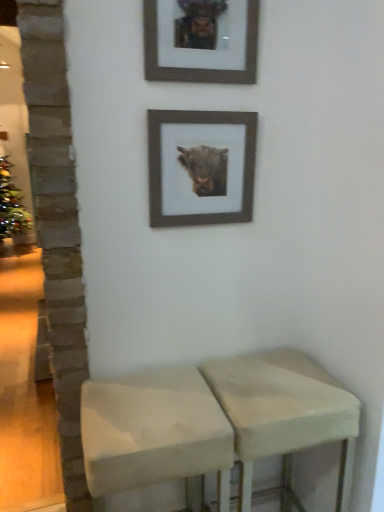
Describe the element at coordinates (284, 415) in the screenshot. I see `beige fabric stool at lower center, the second stool from the left` at that location.

In order to face beige fabric stool at lower center, which appears as the first stool when viewed from the right, should I rotate leftwards or rightwards?

It's best to rotate right around 11.016 degrees.

This screenshot has height=512, width=384. What do you see at coordinates (201, 41) in the screenshot? I see `wooden picture frame at upper center, positioned as the second picture frame in bottom-to-top order` at bounding box center [201, 41].

At what (x,y) coordinates should I click in order to perform the action: click on wooden frame at upper center, positioned as the second picture frame in top-to-bottom order. Please return your answer as a coordinate pair (x, y). Looking at the image, I should click on (201, 167).

Is beige fabric stool at lower center, which appears as the first stool when viewed from the right, located outside white fabric stool at center, which ranks as the 1th stool in left-to-right order?

Yes, beige fabric stool at lower center, which appears as the first stool when viewed from the right, is outside of white fabric stool at center, which ranks as the 1th stool in left-to-right order.

From the picture: Does beige fabric stool at lower center, the second stool from the left, have a larger size compared to white fabric stool at center, which ranks as the 1th stool in left-to-right order?

Correct, beige fabric stool at lower center, the second stool from the left, is larger in size than white fabric stool at center, which ranks as the 1th stool in left-to-right order.

Is beige fabric stool at lower center, which appears as the first stool when viewed from the right, oriented towards white fabric stool at center, positioned as the second stool in right-to-left order?

No, beige fabric stool at lower center, which appears as the first stool when viewed from the right, is not turned towards white fabric stool at center, positioned as the second stool in right-to-left order.

From the image's perspective, is wooden frame at upper center, placed as the 1th picture frame when sorted from bottom to top, below beige fabric stool at lower center, the second stool from the left?

No.

Which object is further away from the camera, wooden frame at upper center, positioned as the second picture frame in top-to-bottom order, or beige fabric stool at lower center, the second stool from the left?

wooden frame at upper center, positioned as the second picture frame in top-to-bottom order, is behind.

Which object is thinner, wooden frame at upper center, positioned as the second picture frame in top-to-bottom order, or beige fabric stool at lower center, the second stool from the left?

Thinner between the two is wooden frame at upper center, positioned as the second picture frame in top-to-bottom order.

From the picture: Is white fabric stool at center, which ranks as the 1th stool in left-to-right order, located outside wooden picture frame at upper center, acting as the first picture frame starting from the top?

white fabric stool at center, which ranks as the 1th stool in left-to-right order, lies outside wooden picture frame at upper center, acting as the first picture frame starting from the top,'s area.

Looking at this image, visually, is white fabric stool at center, which ranks as the 1th stool in left-to-right order, positioned to the left or to the right of wooden picture frame at upper center, acting as the first picture frame starting from the top?

white fabric stool at center, which ranks as the 1th stool in left-to-right order, is positioned on wooden picture frame at upper center, acting as the first picture frame starting from the top,'s left side.

Based on their sizes in the image, would you say white fabric stool at center, positioned as the second stool in right-to-left order, is bigger or smaller than wooden picture frame at upper center, acting as the first picture frame starting from the top?

In the image, white fabric stool at center, positioned as the second stool in right-to-left order, appears to be larger than wooden picture frame at upper center, acting as the first picture frame starting from the top.

From the picture: Is wooden frame at upper center, placed as the 1th picture frame when sorted from bottom to top, inside or outside of white fabric stool at center, which ranks as the 1th stool in left-to-right order?

The correct answer is: outside.

From a real-world perspective, is wooden frame at upper center, positioned as the second picture frame in top-to-bottom order, located higher than white fabric stool at center, which ranks as the 1th stool in left-to-right order?

Yes, from a real-world perspective, wooden frame at upper center, positioned as the second picture frame in top-to-bottom order, is over white fabric stool at center, which ranks as the 1th stool in left-to-right order

Between wooden frame at upper center, positioned as the second picture frame in top-to-bottom order, and white fabric stool at center, positioned as the second stool in right-to-left order, which one appears on the left side from the viewer's perspective?

From the viewer's perspective, white fabric stool at center, positioned as the second stool in right-to-left order, appears more on the left side.

Who is smaller, wooden frame at upper center, placed as the 1th picture frame when sorted from bottom to top, or white fabric stool at center, positioned as the second stool in right-to-left order?

wooden frame at upper center, placed as the 1th picture frame when sorted from bottom to top.

Find the location of a particular element. the 2nd picture frame to the right when counting from the white fabric stool at center, positioned as the second stool in right-to-left order is located at coordinates (201, 167).

Considering the points (138, 459) and (211, 220), which point is behind, point (138, 459) or point (211, 220)?

The point (211, 220) is behind.

Which is correct: white fabric stool at center, which ranks as the 1th stool in left-to-right order, is inside wooden frame at upper center, placed as the 1th picture frame when sorted from bottom to top, or outside of it?

white fabric stool at center, which ranks as the 1th stool in left-to-right order, is located beyond the bounds of wooden frame at upper center, placed as the 1th picture frame when sorted from bottom to top.

Would you consider white fabric stool at center, positioned as the second stool in right-to-left order, to be distant from wooden frame at upper center, placed as the 1th picture frame when sorted from bottom to top?

No.

Which object is wider, white fabric stool at center, which ranks as the 1th stool in left-to-right order, or beige fabric stool at lower center, which appears as the first stool when viewed from the right?

Wider between the two is white fabric stool at center, which ranks as the 1th stool in left-to-right order.

Is white fabric stool at center, which ranks as the 1th stool in left-to-right order, taller or shorter than beige fabric stool at lower center, the second stool from the left?

Clearly, white fabric stool at center, which ranks as the 1th stool in left-to-right order, is shorter compared to beige fabric stool at lower center, the second stool from the left.

Is white fabric stool at center, which ranks as the 1th stool in left-to-right order, aimed at beige fabric stool at lower center, which appears as the first stool when viewed from the right?

No, white fabric stool at center, which ranks as the 1th stool in left-to-right order, does not turn towards beige fabric stool at lower center, which appears as the first stool when viewed from the right.

How much distance is there between white fabric stool at center, positioned as the second stool in right-to-left order, and beige fabric stool at lower center, the second stool from the left?

A distance of 19.53 centimeters exists between white fabric stool at center, positioned as the second stool in right-to-left order, and beige fabric stool at lower center, the second stool from the left.

Is point (238, 426) behind point (212, 26)?

No, (238, 426) is in front of (212, 26).

Which of these two, beige fabric stool at lower center, which appears as the first stool when viewed from the right, or wooden picture frame at upper center, acting as the first picture frame starting from the top, is bigger?

beige fabric stool at lower center, which appears as the first stool when viewed from the right.

I want to click on the 2nd stool located beneath the wooden picture frame at upper center, acting as the first picture frame starting from the top (from a real-world perspective), so click(284, 415).

Is beige fabric stool at lower center, the second stool from the left, taller than wooden picture frame at upper center, acting as the first picture frame starting from the top?

Indeed, beige fabric stool at lower center, the second stool from the left, has a greater height compared to wooden picture frame at upper center, acting as the first picture frame starting from the top.

Locate an element on the screen. This screenshot has height=512, width=384. stool lying below the white fabric stool at center, positioned as the second stool in right-to-left order (from the image's perspective) is located at coordinates (284, 415).

Where is `the 2nd picture frame behind the beige fabric stool at lower center, the second stool from the left`? the 2nd picture frame behind the beige fabric stool at lower center, the second stool from the left is located at coordinates (201, 167).

Based on their spatial positions, is wooden frame at upper center, positioned as the second picture frame in top-to-bottom order, or wooden picture frame at upper center, acting as the first picture frame starting from the top, closer to white fabric stool at center, positioned as the second stool in right-to-left order?

wooden frame at upper center, positioned as the second picture frame in top-to-bottom order, is positioned closer to the anchor white fabric stool at center, positioned as the second stool in right-to-left order.

Which object lies nearer to the anchor point beige fabric stool at lower center, which appears as the first stool when viewed from the right, white fabric stool at center, which ranks as the 1th stool in left-to-right order, or wooden frame at upper center, positioned as the second picture frame in top-to-bottom order?

The object closer to beige fabric stool at lower center, which appears as the first stool when viewed from the right, is white fabric stool at center, which ranks as the 1th stool in left-to-right order.

When comparing their distances from wooden frame at upper center, placed as the 1th picture frame when sorted from bottom to top, does wooden picture frame at upper center, acting as the first picture frame starting from the top, or white fabric stool at center, which ranks as the 1th stool in left-to-right order, seem further?

The object further to wooden frame at upper center, placed as the 1th picture frame when sorted from bottom to top, is white fabric stool at center, which ranks as the 1th stool in left-to-right order.

Looking at the image, which one is located closer to wooden picture frame at upper center, acting as the first picture frame starting from the top, white fabric stool at center, which ranks as the 1th stool in left-to-right order, or wooden frame at upper center, placed as the 1th picture frame when sorted from bottom to top?

Based on the image, wooden frame at upper center, placed as the 1th picture frame when sorted from bottom to top, appears to be nearer to wooden picture frame at upper center, acting as the first picture frame starting from the top.

Estimate the real-world distances between objects in this image. Which object is closer to wooden picture frame at upper center, positioned as the second picture frame in bottom-to-top order, white fabric stool at center, positioned as the second stool in right-to-left order, or beige fabric stool at lower center, the second stool from the left?

white fabric stool at center, positioned as the second stool in right-to-left order, is positioned closer to the anchor wooden picture frame at upper center, positioned as the second picture frame in bottom-to-top order.

Which object lies nearer to the anchor point white fabric stool at center, positioned as the second stool in right-to-left order, wooden picture frame at upper center, positioned as the second picture frame in bottom-to-top order, or wooden frame at upper center, positioned as the second picture frame in top-to-bottom order?

wooden frame at upper center, positioned as the second picture frame in top-to-bottom order, is closer to white fabric stool at center, positioned as the second stool in right-to-left order.

When comparing their distances from wooden frame at upper center, placed as the 1th picture frame when sorted from bottom to top, does beige fabric stool at lower center, which appears as the first stool when viewed from the right, or wooden picture frame at upper center, positioned as the second picture frame in bottom-to-top order, seem closer?

Among the two, wooden picture frame at upper center, positioned as the second picture frame in bottom-to-top order, is located nearer to wooden frame at upper center, placed as the 1th picture frame when sorted from bottom to top.

Looking at the image, which one is located closer to wooden picture frame at upper center, positioned as the second picture frame in bottom-to-top order, beige fabric stool at lower center, the second stool from the left, or wooden frame at upper center, positioned as the second picture frame in top-to-bottom order?

wooden frame at upper center, positioned as the second picture frame in top-to-bottom order, is positioned closer to the anchor wooden picture frame at upper center, positioned as the second picture frame in bottom-to-top order.

Find the location of a particular element. picture frame between wooden picture frame at upper center, acting as the first picture frame starting from the top, and white fabric stool at center, which ranks as the 1th stool in left-to-right order, in the up-down direction is located at coordinates (201, 167).

Identify the location of picture frame between wooden picture frame at upper center, positioned as the second picture frame in bottom-to-top order, and beige fabric stool at lower center, which appears as the first stool when viewed from the right, in the vertical direction. (201, 167).

The image size is (384, 512). In order to click on stool that lies between wooden frame at upper center, placed as the 1th picture frame when sorted from bottom to top, and beige fabric stool at lower center, the second stool from the left, from top to bottom in this screenshot , I will do `click(154, 434)`.

Identify the location of stool between wooden picture frame at upper center, acting as the first picture frame starting from the top, and beige fabric stool at lower center, the second stool from the left, vertically. Image resolution: width=384 pixels, height=512 pixels. (154, 434).